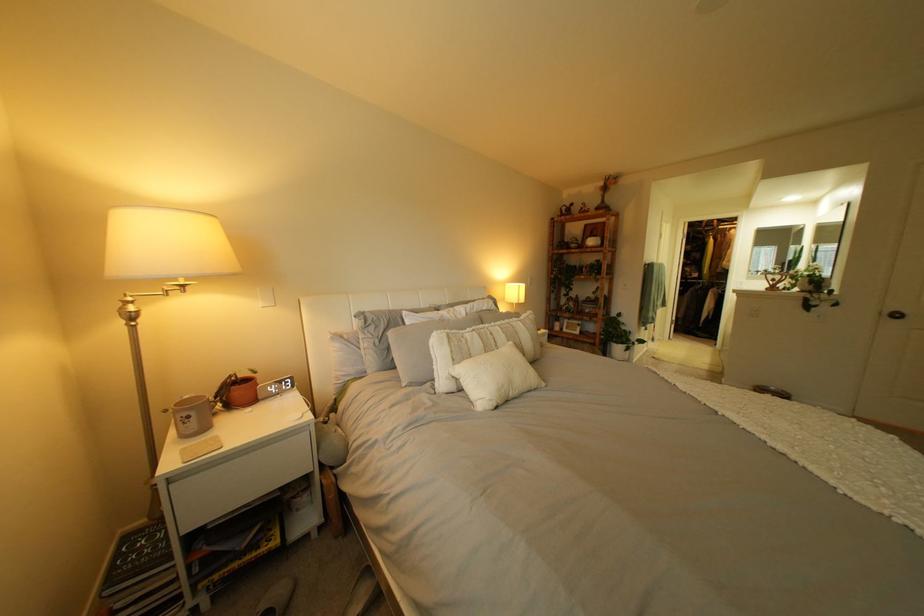
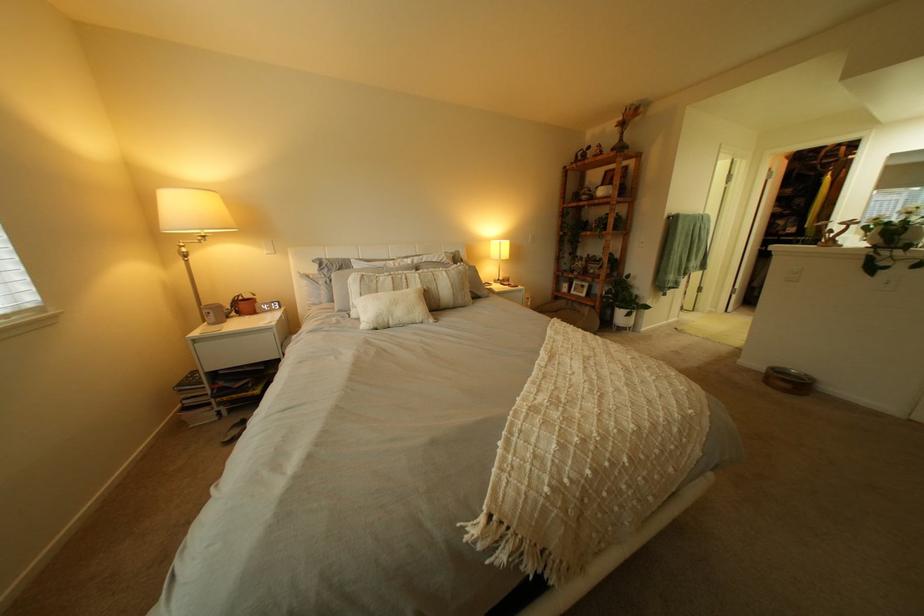
Find the pixel in the second image that matches point (204, 418) in the first image.

(225, 314)